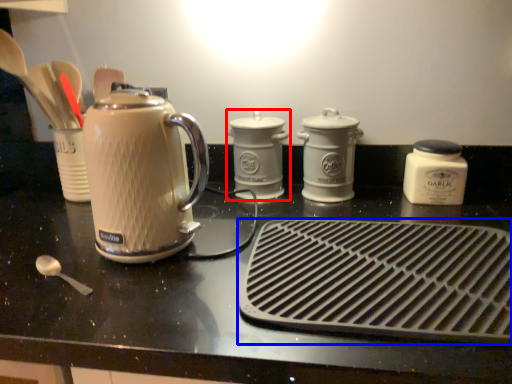
Question: Among these objects, which one is farthest to the camera, kitchen appliance (highlighted by a red box) or kitchen appliance (highlighted by a blue box)?

Choices:
 (A) kitchen appliance
 (B) kitchen appliance

Answer: (A)